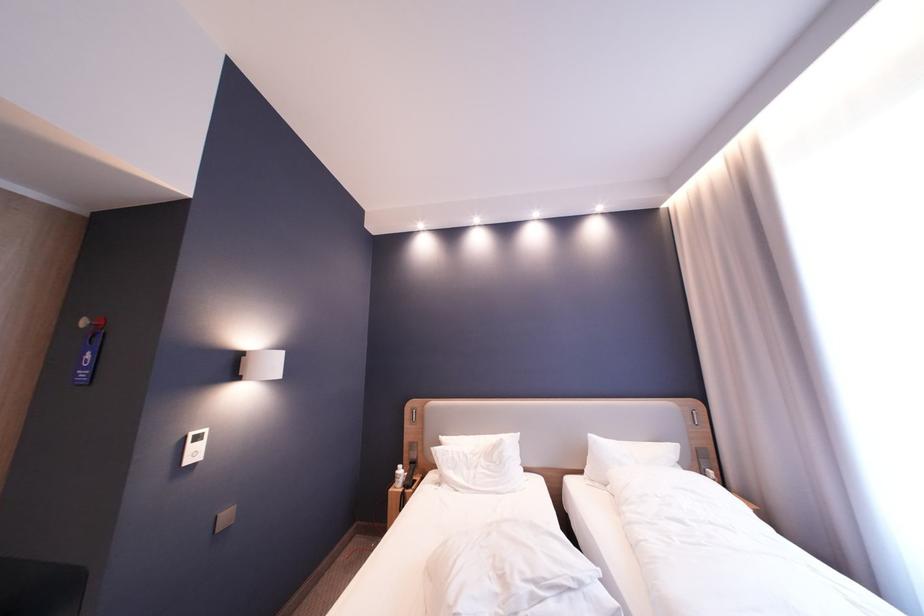
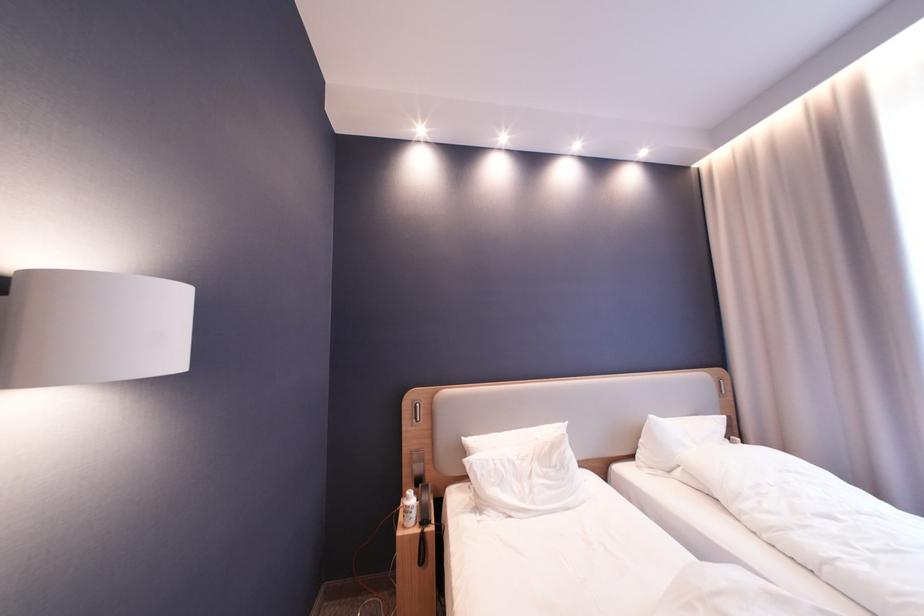
In a continuous first-person perspective shot, in which direction is the camera moving?

The cameraman walked toward left, forward.